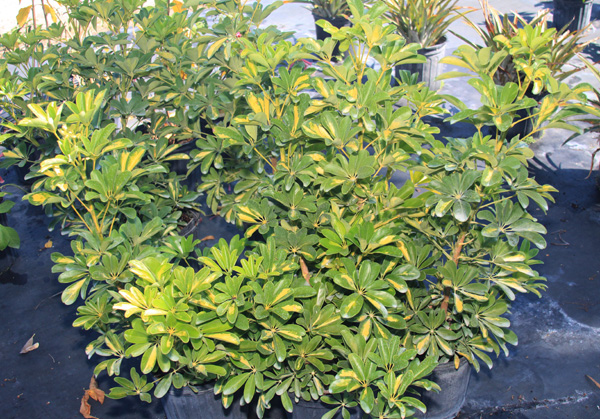
Where is `wall`? Image resolution: width=600 pixels, height=419 pixels. wall is located at coordinates (572, 296).